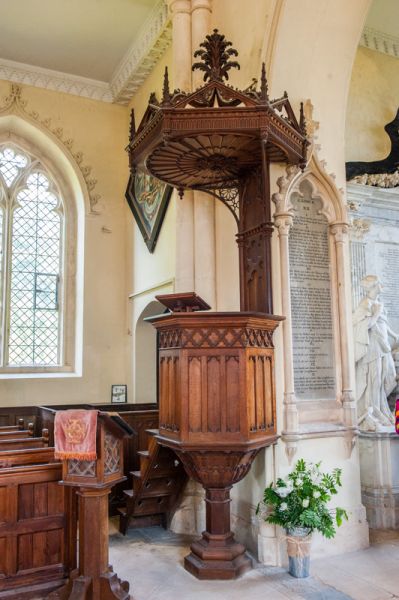
Where is `ceiling`? The height and width of the screenshot is (600, 399). ceiling is located at coordinates coord(62,38), coord(389,26).